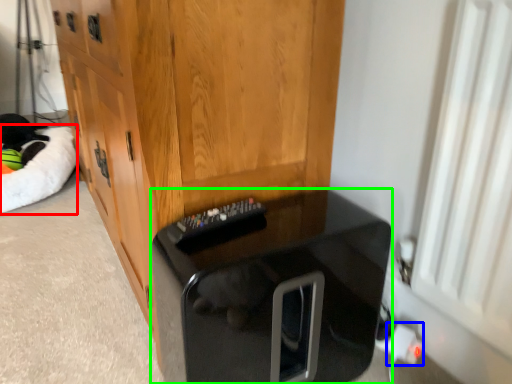
Question: Which object is the farthest from cat bed (highlighted by a red box)? Choose among these: electric outlet (highlighted by a blue box) or furniture (highlighted by a green box).

Choices:
 (A) electric outlet
 (B) furniture

Answer: (A)